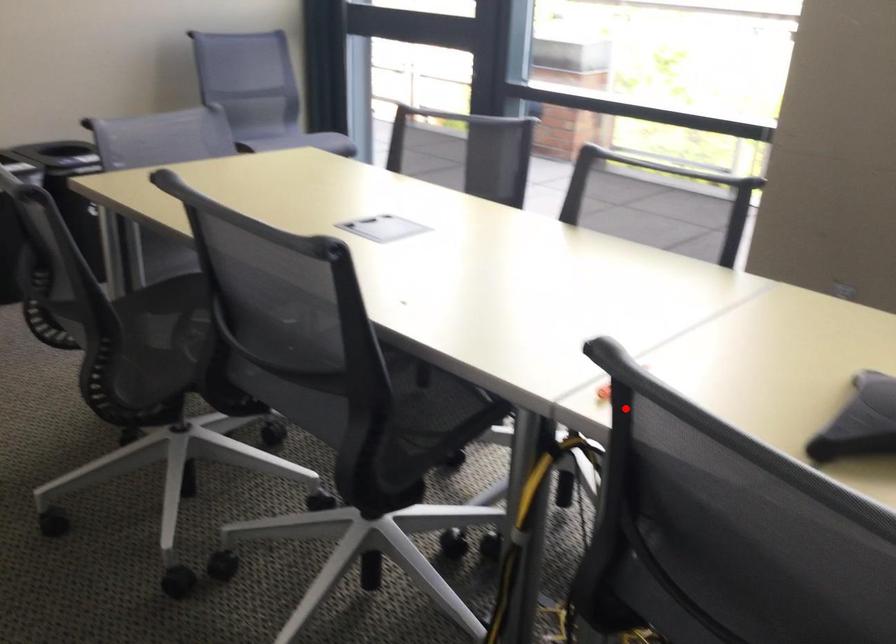
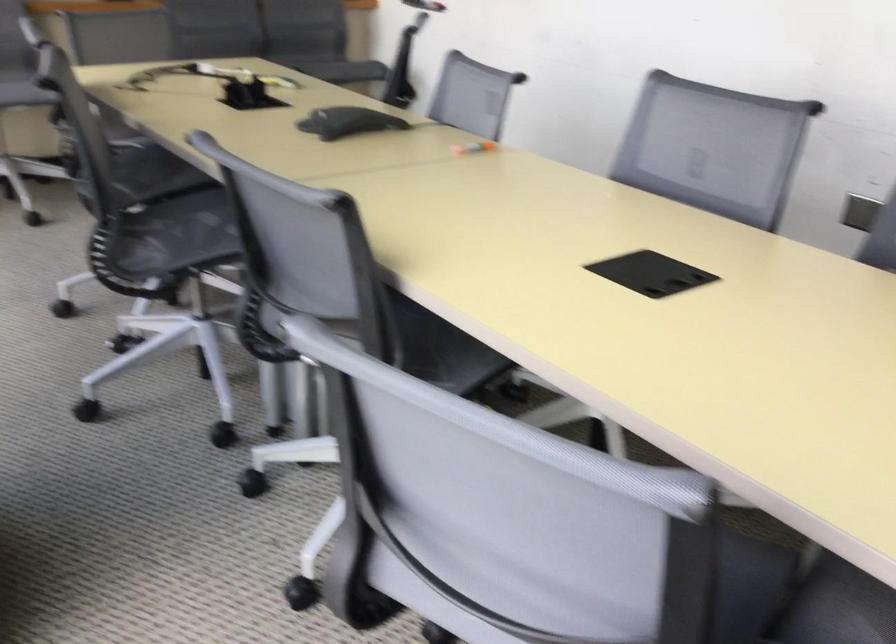
Where in the second image is the point corresponding to the highlighted location from the first image?

(474, 147)